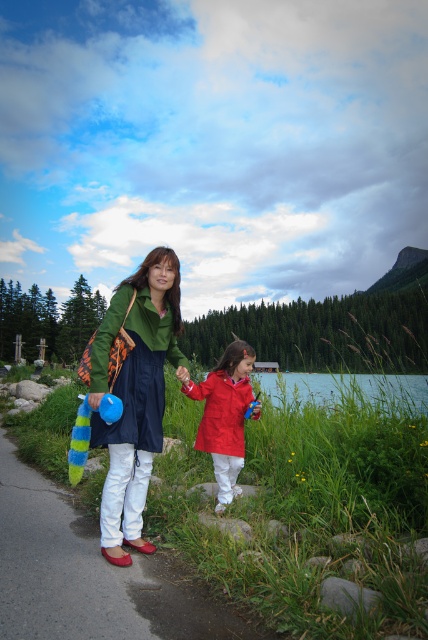
Between matte green dress at center and green grass at lower center, which one appears on the right side from the viewer's perspective?

green grass at lower center is more to the right.

Does matte green dress at center have a lesser width compared to green grass at lower center?

Correct, matte green dress at center's width is less than green grass at lower center's.

Find the location of `matte green dress at center`. matte green dress at center is located at coordinates (134, 394).

What do you see at coordinates (134, 394) in the screenshot? Image resolution: width=428 pixels, height=640 pixels. I see `matte green dress at center` at bounding box center [134, 394].

Who is more forward, (130, 422) or (238, 470)?

Point (130, 422) is more forward.

Does point (118, 474) lie in front of point (250, 365)?

Yes, point (118, 474) is in front of point (250, 365).

The width and height of the screenshot is (428, 640). In order to click on matte green dress at center in this screenshot , I will do `click(134, 394)`.

What do you see at coordinates (92, 576) in the screenshot? I see `white smooth path at lower left` at bounding box center [92, 576].

Who is lower down, white smooth path at lower left or matte red jacket at center?

white smooth path at lower left

Is point (216, 620) positioned in front of point (222, 445)?

Yes, point (216, 620) is closer to viewer.

Locate an element on the screen. white smooth path at lower left is located at coordinates (92, 576).